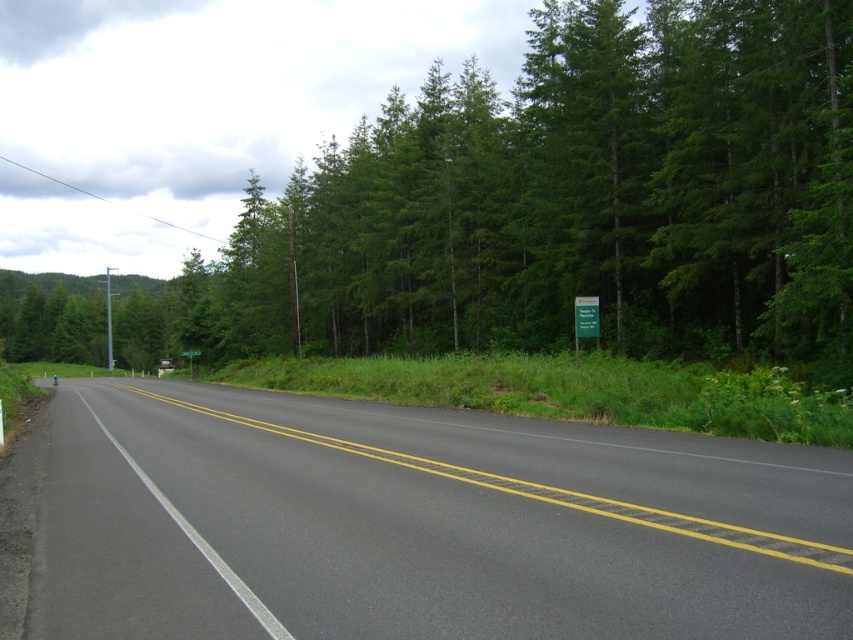
Question: Observing the image, what is the correct spatial positioning of black asphalt highway at center in reference to green plastic sign at center?

Choices:
 (A) above
 (B) below

Answer: (A)

Question: Is green leafy tree at center closer to camera compared to black asphalt highway at center?

Choices:
 (A) yes
 (B) no

Answer: (B)

Question: Which object appears closest to the camera in this image?

Choices:
 (A) green leafy tree at center
 (B) black asphalt highway at center

Answer: (B)

Question: Among these objects, which one is nearest to the camera?

Choices:
 (A) green plastic sign at center
 (B) green leafy tree at center

Answer: (B)

Question: Can you confirm if green leafy tree at center is wider than green plastic sign at center?

Choices:
 (A) no
 (B) yes

Answer: (B)

Question: Which of these objects is positioned farthest from the green leafy tree at center?

Choices:
 (A) green plastic sign at center
 (B) black asphalt highway at center

Answer: (A)